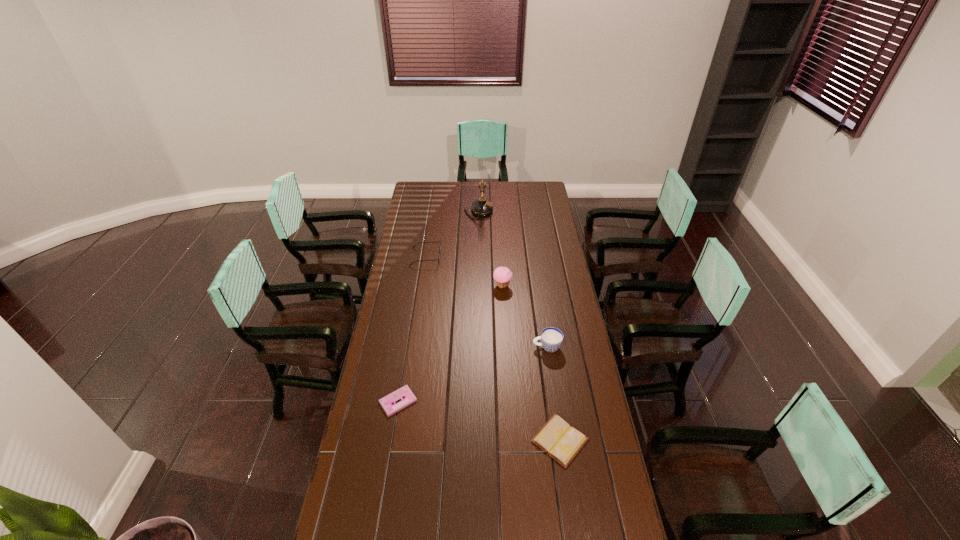
Where is `videotape that is positioned at the left edge`? videotape that is positioned at the left edge is located at coordinates (388, 403).

Find the location of a particular element. cup at the right edge is located at coordinates (551, 338).

I want to click on diary that is at the right edge, so click(x=557, y=438).

Locate an element on the screen. This screenshot has height=540, width=960. vacant space at the far edge is located at coordinates (440, 197).

In the image, there is a desktop. Where is `free region at the left edge`? free region at the left edge is located at coordinates pos(385,348).

You are a GUI agent. You are given a task and a screenshot of the screen. Output one action in this format:
    pyautogui.click(x=<x>, y=<y>)
    Task: Click on the vacant space at the right edge
    
    Given the screenshot: What is the action you would take?
    pyautogui.click(x=561, y=309)

Where is `vacant region between the tallest object and the cupcake`? The width and height of the screenshot is (960, 540). vacant region between the tallest object and the cupcake is located at coordinates (491, 248).

Locate an element on the screen. The width and height of the screenshot is (960, 540). vacant area between the spectacles and the tallest object is located at coordinates (452, 234).

Where is `vacant area that lies between the cupcake and the fifth tallest object`? vacant area that lies between the cupcake and the fifth tallest object is located at coordinates (531, 363).

Where is `vacant space that is in between the shortest object and the third farthest object`? The width and height of the screenshot is (960, 540). vacant space that is in between the shortest object and the third farthest object is located at coordinates (450, 343).